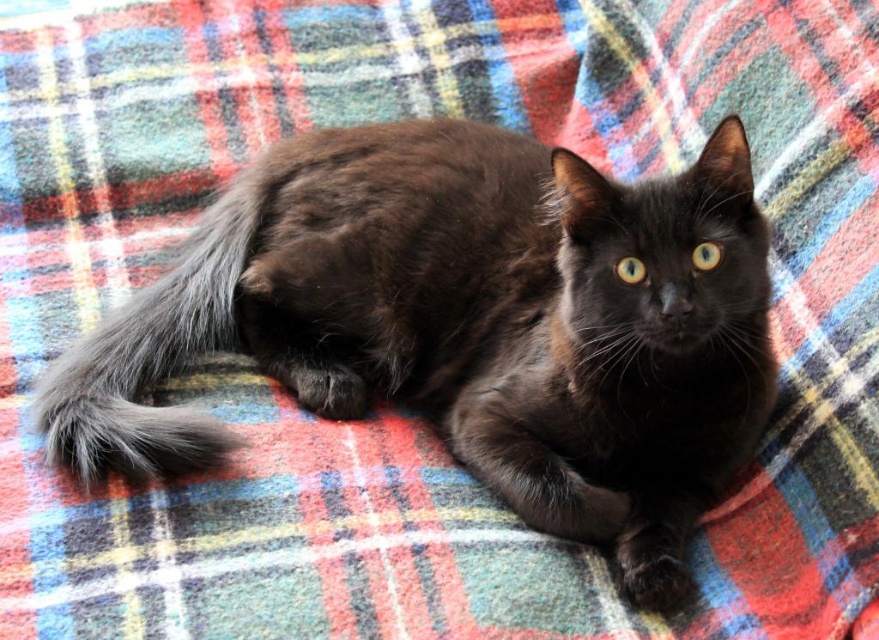
Between shiny black cat at center and gray fluffy tail at lower left, which one appears on the left side from the viewer's perspective?

Positioned to the left is gray fluffy tail at lower left.

Is shiny black cat at center positioned in front of gray fluffy tail at lower left?

Yes.

Is point (702, 256) closer to camera compared to point (122, 349)?

Yes, it is in front of point (122, 349).

You are a GUI agent. You are given a task and a screenshot of the screen. Output one action in this format:
    pyautogui.click(x=<x>, y=<y>)
    Task: Click on the shiny black cat at center
    
    Given the screenshot: What is the action you would take?
    coord(467,324)